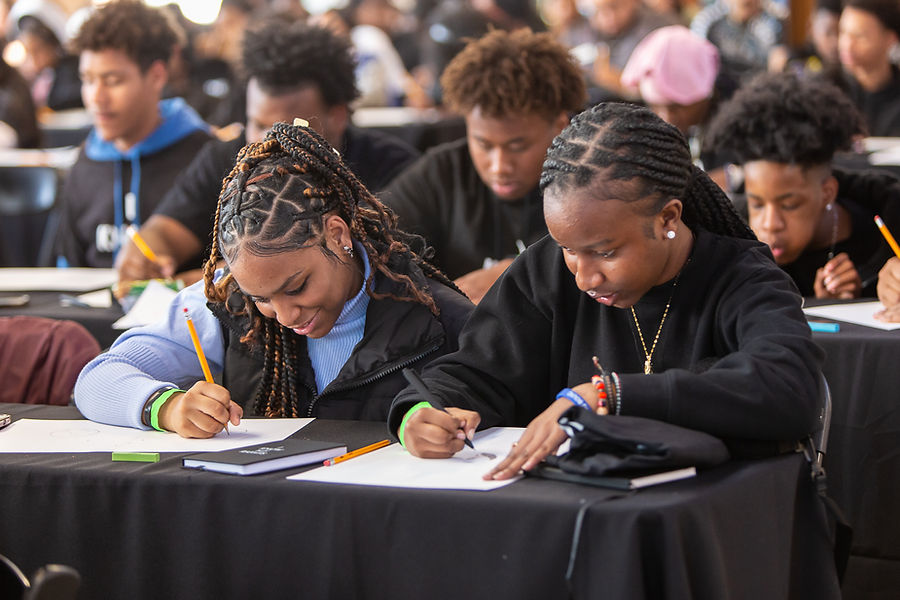
This screenshot has width=900, height=600. Identify the location of front table. (294, 520).